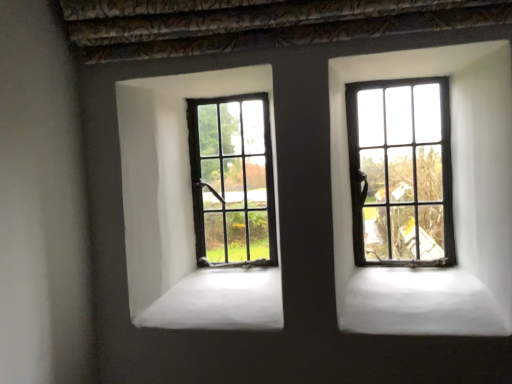
Question: In terms of size, does matte black window at right, which ranks as the second window in left-to-right order, appear bigger or smaller than matte black window at center, the 2th window from the front?

Choices:
 (A) small
 (B) big

Answer: (B)

Question: Is matte black window at right, which ranks as the second window in left-to-right order, spatially inside matte black window at center, positioned as the first window in left-to-right order, or outside of it?

Choices:
 (A) outside
 (B) inside

Answer: (A)

Question: Is matte black window at right, which is the 2th window in back-to-front order, in front of or behind matte black window at center, the second window positioned from the right, in the image?

Choices:
 (A) front
 (B) behind

Answer: (A)

Question: Is matte black window at center, the 2th window from the front, bigger or smaller than matte black window at right, positioned as the first window in right-to-left order?

Choices:
 (A) small
 (B) big

Answer: (A)

Question: Is point [237, 226] closer or farther from the camera than point [453, 246]?

Choices:
 (A) farther
 (B) closer

Answer: (A)

Question: Relative to matte black window at right, positioned as the first window in right-to-left order, is matte black window at center, the second window positioned from the right, in front or behind?

Choices:
 (A) front
 (B) behind

Answer: (B)

Question: Do you think matte black window at center, positioned as the first window in left-to-right order, is within matte black window at right, which is the 2th window in back-to-front order, or outside of it?

Choices:
 (A) inside
 (B) outside

Answer: (B)